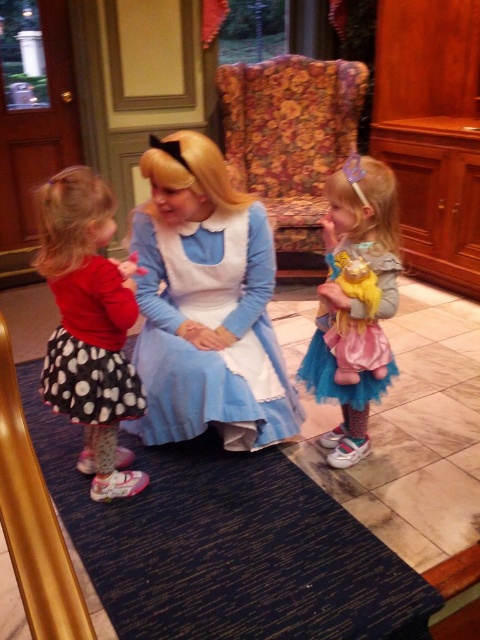
You are a photographer standing in front of the Alice in Wonderland themed area. You need to take a photo of the blue satin dress at center and the black dotted fabric dress at left. Which dress will appear larger in the photo?

The blue satin dress at center will appear larger in the photo because it is closer to the photographer than the black dotted fabric dress at left.

You are a costume designer observing the Alice in Wonderland themed area. You need to determine which costume is taller between the blue satin dress at center and the black dotted fabric dress at left. Which one is taller?

The blue satin dress at center is taller than the black dotted fabric dress at left according to the description.

You are a photographer at the themed area. You need to capture a photo of the two children interacting with Alice. The polka dot skirt at left and the black dotted fabric dress at left are both in the frame. Which child is positioned more to the left side of the photo?

The polka dot skirt at left is positioned to the left of the black dotted fabric dress at left, so the child wearing the polka dot skirt at left is more to the left side of the photo.